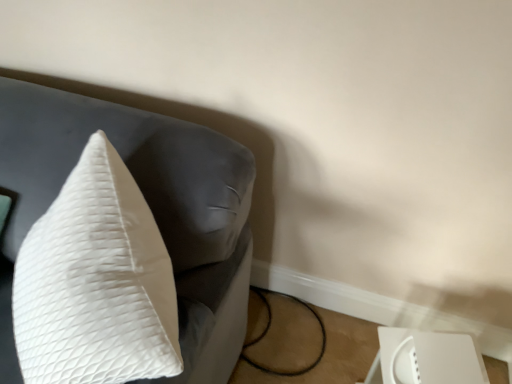
The width and height of the screenshot is (512, 384). I want to click on white quilted pillow at upper left, so click(x=147, y=202).

What do you see at coordinates (147, 202) in the screenshot? This screenshot has width=512, height=384. I see `white quilted pillow at upper left` at bounding box center [147, 202].

Locate an element on the screen. This screenshot has height=384, width=512. white quilted pillow at upper left is located at coordinates (147, 202).